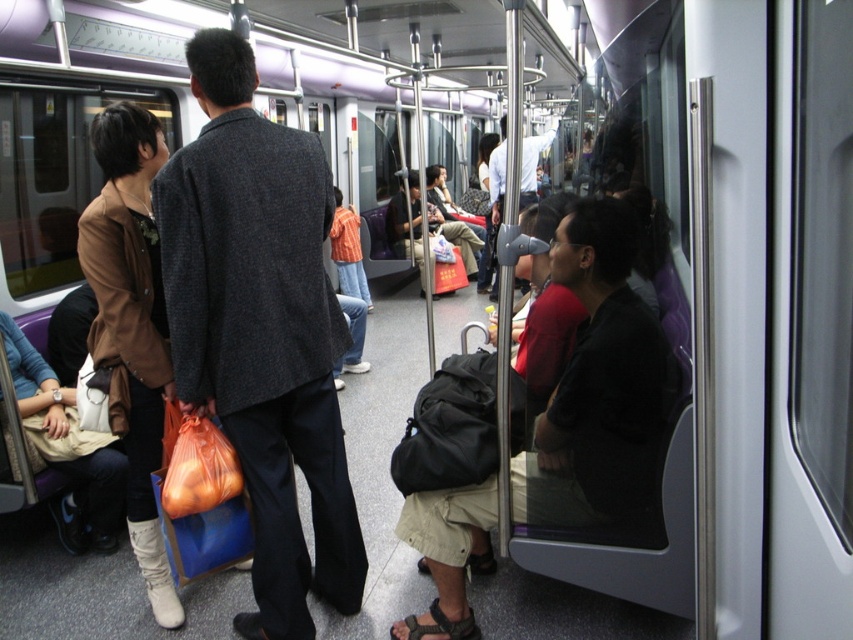
Question: Does matte black jacket at center appear on the left side of beige fabric bag at lower left?

Choices:
 (A) yes
 (B) no

Answer: (B)

Question: Does dark gray backpack at center have a lesser width compared to beige fabric bag at lower left?

Choices:
 (A) no
 (B) yes

Answer: (A)

Question: Which of the following is the closest to the observer?

Choices:
 (A) (149, 269)
 (B) (120, 472)
 (C) (219, 324)

Answer: (C)

Question: Is matte black jacket at center wider than leather boots at lower left?

Choices:
 (A) no
 (B) yes

Answer: (B)

Question: Which of these objects is positioned farthest from the leather boots at lower left?

Choices:
 (A) beige fabric bag at lower left
 (B) dark gray suit at center

Answer: (B)

Question: Which point is closer to the camera taking this photo?

Choices:
 (A) (641, 364)
 (B) (303, 417)
 (C) (496, 195)
 (D) (149, 412)

Answer: (A)